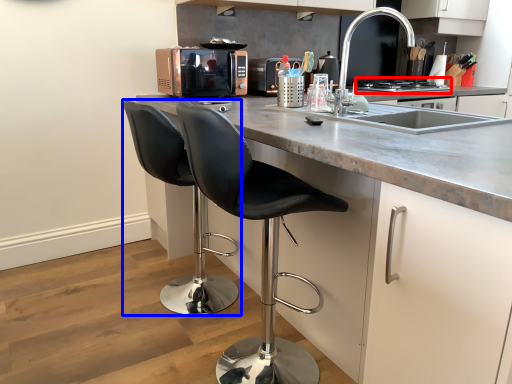
Question: Which point is further to the camera, stove (highlighted by a red box) or chair (highlighted by a blue box)?

Choices:
 (A) stove
 (B) chair

Answer: (A)